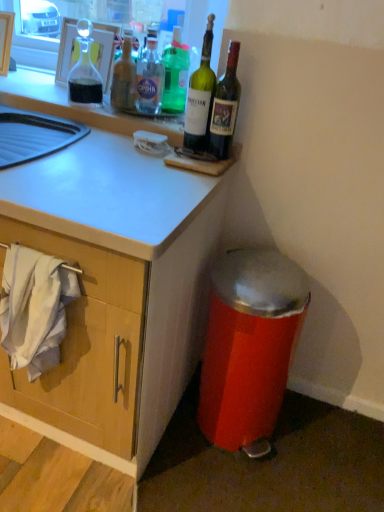
Question: Is green glass bottle at upper right, positioned as the 1th bottle in right-to-left order, completely or partially inside white fabric at lower left?

Choices:
 (A) yes
 (B) no

Answer: (B)

Question: Are white fabric at lower left and green glass bottle at upper right, positioned as the 1th bottle in right-to-left order, located far from each other?

Choices:
 (A) no
 (B) yes

Answer: (A)

Question: Is white fabric at lower left to the left of green glass bottle at upper right, positioned as the 1th bottle in right-to-left order, from the viewer's perspective?

Choices:
 (A) yes
 (B) no

Answer: (A)

Question: Considering the relative sizes of white fabric at lower left and green glass bottle at upper right, positioned as the 1th bottle in right-to-left order, in the image provided, is white fabric at lower left shorter than green glass bottle at upper right, positioned as the 1th bottle in right-to-left order,?

Choices:
 (A) yes
 (B) no

Answer: (B)

Question: From a real-world perspective, is white fabric at lower left on green glass bottle at upper right, positioned as the 1th bottle in right-to-left order?

Choices:
 (A) yes
 (B) no

Answer: (B)

Question: Is point (218, 117) closer or farther from the camera than point (46, 323)?

Choices:
 (A) farther
 (B) closer

Answer: (A)

Question: In terms of size, does green glass bottle at upper right, positioned as the 1th bottle in right-to-left order, appear bigger or smaller than white fabric at lower left?

Choices:
 (A) big
 (B) small

Answer: (B)

Question: From a real-world perspective, is green glass bottle at upper right, positioned as the 1th bottle in right-to-left order, above or below white fabric at lower left?

Choices:
 (A) below
 (B) above

Answer: (B)

Question: From the image's perspective, is green glass bottle at upper right, positioned as the 1th bottle in right-to-left order, above or below white fabric at lower left?

Choices:
 (A) above
 (B) below

Answer: (A)

Question: From the image's perspective, relative to translucent glass bottle at upper center, acting as the fifth bottle starting from the right, is green glass bottle at upper center, positioned as the third bottle in left-to-right order, above or below?

Choices:
 (A) below
 (B) above

Answer: (B)

Question: Which is correct: green glass bottle at upper center, positioned as the 3th bottle in right-to-left order, is inside translucent glass bottle at upper center, marked as the 1th bottle in a left-to-right arrangement, or outside of it?

Choices:
 (A) outside
 (B) inside

Answer: (A)

Question: From a real-world perspective, is green glass bottle at upper center, positioned as the third bottle in left-to-right order, positioned above or below translucent glass bottle at upper center, marked as the 1th bottle in a left-to-right arrangement?

Choices:
 (A) above
 (B) below

Answer: (A)

Question: Considering the positions of point (165, 84) and point (117, 106), is point (165, 84) closer or farther from the camera than point (117, 106)?

Choices:
 (A) closer
 (B) farther

Answer: (A)

Question: Is point (33, 250) closer or farther from the camera than point (145, 93)?

Choices:
 (A) farther
 (B) closer

Answer: (B)

Question: In terms of height, does white fabric at lower left look taller or shorter compared to clear glass bottle at upper center, the 4th bottle when ordered from right to left?

Choices:
 (A) short
 (B) tall

Answer: (B)